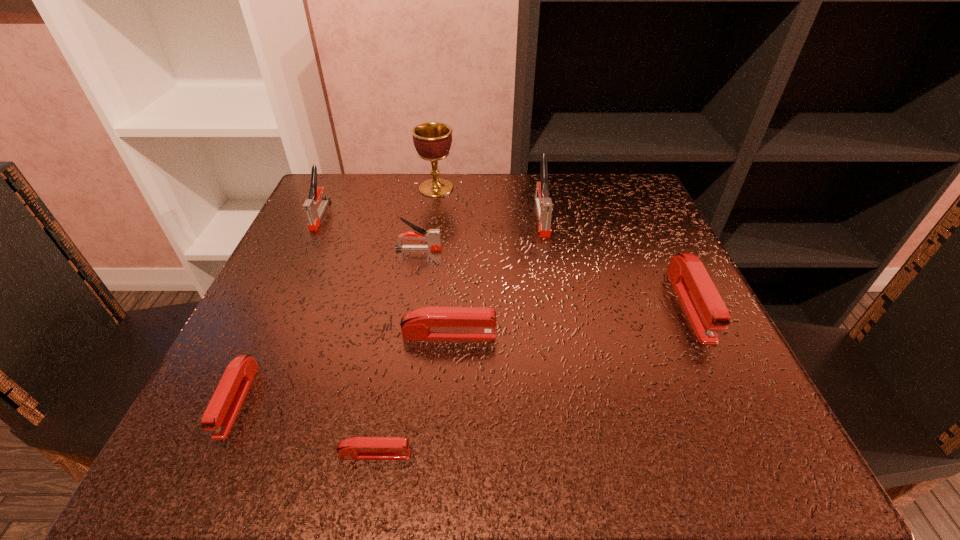
At what (x,y) coordinates should I click in order to perform the action: click on free location at the far left corner of the desktop. Please return your answer as a coordinate pair (x, y). Looking at the image, I should click on (370, 230).

Locate an element on the screen. The height and width of the screenshot is (540, 960). free location at the far right corner is located at coordinates (621, 221).

This screenshot has height=540, width=960. In the image, there is a desktop. Identify the location of vacant space at the near right corner. (731, 412).

Locate an element on the screen. This screenshot has width=960, height=540. vacant point located between the sixth tallest object and the rightmost gray stapler is located at coordinates click(x=495, y=276).

Find the location of `vacant space that's between the second tallest stapler and the sixth tallest object`. vacant space that's between the second tallest stapler and the sixth tallest object is located at coordinates (385, 275).

Locate an element on the screen. free space between the fifth tallest stapler and the rightmost red stapler is located at coordinates (569, 320).

Where is `free spot between the second biggest gray stapler and the golden chalice`? Image resolution: width=960 pixels, height=540 pixels. free spot between the second biggest gray stapler and the golden chalice is located at coordinates (378, 201).

Image resolution: width=960 pixels, height=540 pixels. I want to click on free space between the third shortest object and the rightmost object, so click(569, 320).

Find the location of a particular element. Image resolution: width=960 pixels, height=540 pixels. free point between the nearest object and the second tallest stapler is located at coordinates (348, 334).

This screenshot has height=540, width=960. I want to click on blank region between the sixth shortest stapler and the rightmost gray stapler, so click(431, 215).